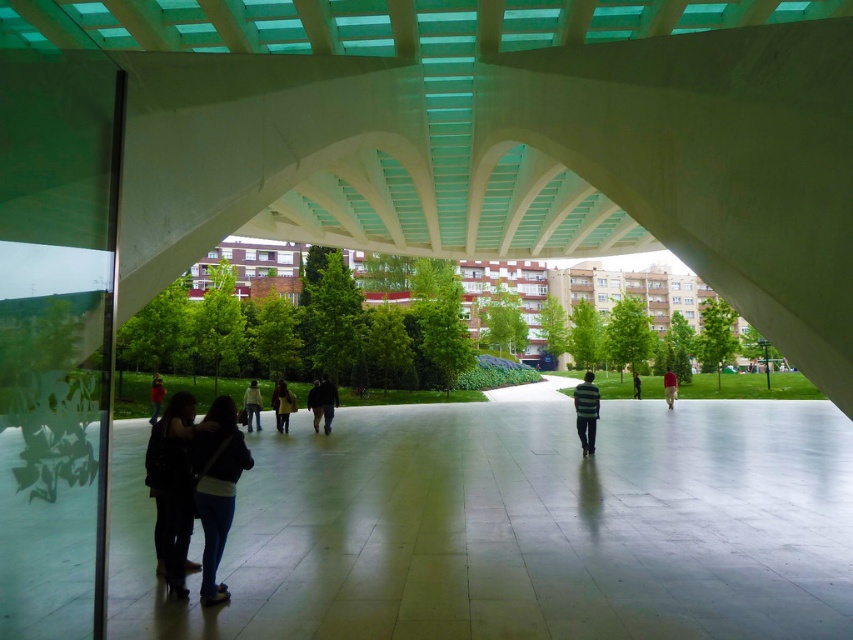
Question: Can you confirm if smooth concrete floor at center is positioned to the left of dark brown leather jacket at center?

Choices:
 (A) yes
 (B) no

Answer: (B)

Question: Is denim jacket at lower left to the left of striped sweater at center from the viewer's perspective?

Choices:
 (A) no
 (B) yes

Answer: (B)

Question: Which point is farther to the camera?

Choices:
 (A) (155, 387)
 (B) (160, 419)

Answer: (A)

Question: Is dark gray fabric jacket at center further to camera compared to tan fabric pants at center?

Choices:
 (A) no
 (B) yes

Answer: (A)

Question: Which object is closer to the camera taking this photo?

Choices:
 (A) denim jacket at lower left
 (B) dark brown leather jacket at center

Answer: (A)

Question: Among these points, which one is farthest from the camera?

Choices:
 (A) (154, 404)
 (B) (666, 394)
 (C) (281, 385)
 (D) (637, 387)

Answer: (D)